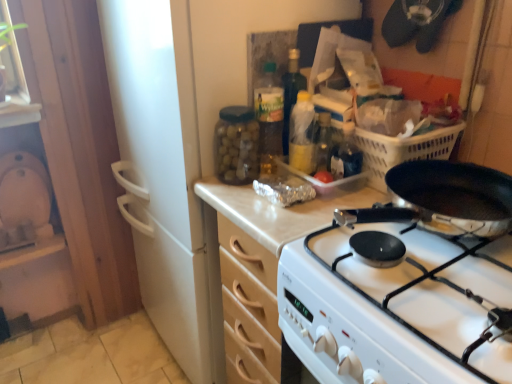
Describe the element at coordinates (433, 292) in the screenshot. I see `white glossy gas stove at center` at that location.

Where is `translucent plastic bottle at center, acting as the 1th bottle starting from the right`? The image size is (512, 384). translucent plastic bottle at center, acting as the 1th bottle starting from the right is located at coordinates (301, 134).

At what (x,y) coordinates should I click in order to perform the action: click on translucent plastic bottle at center, placed as the second bottle when sorted from left to right. Please return your answer as a coordinate pair (x, y). The image size is (512, 384). Looking at the image, I should click on (291, 92).

Is the surface of translucent plastic bottle at center, placed as the second bottle when sorted from left to right, in direct contact with translucent plastic bottle at center, acting as the third bottle starting from the left?

Yes, translucent plastic bottle at center, placed as the second bottle when sorted from left to right, is right next to translucent plastic bottle at center, acting as the third bottle starting from the left, and making contact.

Considering the sizes of objects translucent plastic bottle at center, placed as the second bottle when sorted from left to right, and translucent plastic bottle at center, acting as the third bottle starting from the left, in the image provided, who is shorter, translucent plastic bottle at center, placed as the second bottle when sorted from left to right, or translucent plastic bottle at center, acting as the third bottle starting from the left,?

With less height is translucent plastic bottle at center, acting as the third bottle starting from the left.

From a real-world perspective, is translucent plastic bottle at center, placed as the second bottle when sorted from left to right, under translucent plastic bottle at center, acting as the third bottle starting from the left?

No, from a real-world perspective, translucent plastic bottle at center, placed as the second bottle when sorted from left to right, is not beneath translucent plastic bottle at center, acting as the third bottle starting from the left.

Is translucent plastic bottle at center, the 2th bottle viewed from the right, oriented towards translucent plastic bottle at center, acting as the 1th bottle starting from the right?

No, translucent plastic bottle at center, the 2th bottle viewed from the right, is not turned towards translucent plastic bottle at center, acting as the 1th bottle starting from the right.

Is transparent glass jar at upper center, which is the third bottle from right to left, next to white glossy gas stove at center and touching it?

transparent glass jar at upper center, which is the third bottle from right to left, is not next to white glossy gas stove at center, and they're not touching.

Is white glossy gas stove at center surrounded by transparent glass jar at upper center, which is the first bottle from left to right?

That's incorrect, white glossy gas stove at center is not inside transparent glass jar at upper center, which is the first bottle from left to right.

Which is in front, transparent glass jar at upper center, which is the first bottle from left to right, or white glossy gas stove at center?

white glossy gas stove at center is more forward.

Is transparent glass jar at upper center, which is the first bottle from left to right, bigger than white glossy gas stove at center?

No.

Does white glossy gas stove at center have a smaller size compared to translucent plastic bottle at center, acting as the third bottle starting from the left?

Actually, white glossy gas stove at center might be larger than translucent plastic bottle at center, acting as the third bottle starting from the left.

Is white glossy gas stove at center not inside translucent plastic bottle at center, acting as the 1th bottle starting from the right?

Yes, white glossy gas stove at center is outside of translucent plastic bottle at center, acting as the 1th bottle starting from the right.

Does point (419, 297) come farther from viewer compared to point (294, 146)?

No, it is not.

In the scene shown: Which is more to the left, white glossy gas stove at center or translucent plastic bottle at center, acting as the 1th bottle starting from the right?

translucent plastic bottle at center, acting as the 1th bottle starting from the right.

Between translucent plastic bottle at center, acting as the 1th bottle starting from the right, and clear plastic container at center, which one is positioned in front?

translucent plastic bottle at center, acting as the 1th bottle starting from the right.

Are translucent plastic bottle at center, acting as the 1th bottle starting from the right, and clear plastic container at center located far from each other?

No, translucent plastic bottle at center, acting as the 1th bottle starting from the right, is not far away from clear plastic container at center.

Can you confirm if translucent plastic bottle at center, acting as the third bottle starting from the left, is shorter than clear plastic container at center?

No, translucent plastic bottle at center, acting as the third bottle starting from the left, is not shorter than clear plastic container at center.

Considering the positions of points (285, 76) and (328, 193), is point (285, 76) closer to camera compared to point (328, 193)?

No.

Visually, is translucent plastic bottle at center, placed as the second bottle when sorted from left to right, positioned to the left or to the right of clear plastic container at center?

translucent plastic bottle at center, placed as the second bottle when sorted from left to right, is positioned on clear plastic container at center's left side.

Is translucent plastic bottle at center, placed as the second bottle when sorted from left to right, beside clear plastic container at center?

translucent plastic bottle at center, placed as the second bottle when sorted from left to right, and clear plastic container at center are not in contact.

From the image's perspective, is translucent plastic bottle at center, the 2th bottle viewed from the right, above clear plastic container at center?

Indeed, from the image's perspective, translucent plastic bottle at center, the 2th bottle viewed from the right, is shown above clear plastic container at center.

From the image's perspective, is translucent plastic bottle at center, placed as the second bottle when sorted from left to right, beneath transparent glass jar at upper center, which is the third bottle from right to left?

Answer: No.

How many degrees apart are the facing directions of translucent plastic bottle at center, placed as the second bottle when sorted from left to right, and transparent glass jar at upper center, which is the third bottle from right to left?

The angular difference between translucent plastic bottle at center, placed as the second bottle when sorted from left to right, and transparent glass jar at upper center, which is the third bottle from right to left, is 89.7 degrees.

Is translucent plastic bottle at center, the 2th bottle viewed from the right, surrounding transparent glass jar at upper center, which is the third bottle from right to left?

Definitely not — transparent glass jar at upper center, which is the third bottle from right to left, is not inside translucent plastic bottle at center, the 2th bottle viewed from the right.

Can you confirm if translucent plastic bottle at center, the 2th bottle viewed from the right, is bigger than transparent glass jar at upper center, which is the third bottle from right to left?

No.

Considering the sizes of transparent glass jar at upper center, which is the first bottle from left to right, and translucent plastic bottle at center, acting as the 1th bottle starting from the right, in the image, is transparent glass jar at upper center, which is the first bottle from left to right, bigger or smaller than translucent plastic bottle at center, acting as the 1th bottle starting from the right,?

In the image, transparent glass jar at upper center, which is the first bottle from left to right, appears to be larger than translucent plastic bottle at center, acting as the 1th bottle starting from the right.

In the scene shown: From a real-world perspective, who is located higher, transparent glass jar at upper center, which is the first bottle from left to right, or translucent plastic bottle at center, acting as the third bottle starting from the left?

translucent plastic bottle at center, acting as the third bottle starting from the left.

Which of these two, transparent glass jar at upper center, which is the first bottle from left to right, or translucent plastic bottle at center, acting as the 1th bottle starting from the right, is wider?

transparent glass jar at upper center, which is the first bottle from left to right, is wider.

Can translucent plastic bottle at center, acting as the third bottle starting from the left, be found inside transparent glass jar at upper center, which is the first bottle from left to right?

No, translucent plastic bottle at center, acting as the third bottle starting from the left, is located outside of transparent glass jar at upper center, which is the first bottle from left to right.

This screenshot has width=512, height=384. I want to click on bottle above the translucent plastic bottle at center, acting as the third bottle starting from the left (from a real-world perspective), so click(291, 92).

From the image's perspective, count 1st bottles upward from the white glossy gas stove at center and point to it. Please provide its 2D coordinates.

[(236, 145)]

Which object lies further to the anchor point clear plastic container at center, transparent glass jar at upper center, which is the first bottle from left to right, or translucent plastic bottle at center, acting as the 1th bottle starting from the right?

transparent glass jar at upper center, which is the first bottle from left to right.

In the scene shown: Considering their positions, is white glossy gas stove at center positioned closer to wooden cabinet at center than translucent plastic bottle at center, acting as the 1th bottle starting from the right?

The object closer to wooden cabinet at center is translucent plastic bottle at center, acting as the 1th bottle starting from the right.

Looking at the image, which one is located further to transparent glass jar at upper center, which is the third bottle from right to left, clear plastic container at center or white glossy gas stove at center?

The object further to transparent glass jar at upper center, which is the third bottle from right to left, is white glossy gas stove at center.

Looking at the image, which one is located further to white glossy gas stove at center, wooden cabinet at center or clear plastic container at center?

Based on the image, clear plastic container at center appears to be further to white glossy gas stove at center.

Which object lies further to the anchor point white glossy gas stove at center, wooden cabinet at center or translucent plastic bottle at center, acting as the 1th bottle starting from the right?

Based on the image, translucent plastic bottle at center, acting as the 1th bottle starting from the right, appears to be further to white glossy gas stove at center.

Looking at the image, which one is located closer to translucent plastic bottle at center, acting as the third bottle starting from the left, translucent plastic bottle at center, the 2th bottle viewed from the right, or clear plastic container at center?

translucent plastic bottle at center, the 2th bottle viewed from the right, is positioned closer to the anchor translucent plastic bottle at center, acting as the third bottle starting from the left.

When comparing their distances from transparent glass jar at upper center, which is the first bottle from left to right, does clear plastic container at center or wooden cabinet at center seem further?

clear plastic container at center lies further to transparent glass jar at upper center, which is the first bottle from left to right, than the other object.

When comparing their distances from clear plastic container at center, does wooden cabinet at center or transparent glass jar at upper center, which is the third bottle from right to left, seem closer?

Among the two, wooden cabinet at center is located nearer to clear plastic container at center.

Locate an element on the screen. gas stove between translucent plastic bottle at center, acting as the third bottle starting from the left, and wooden cabinet at center vertically is located at coordinates (433, 292).

Find the location of a particular element. This screenshot has width=512, height=384. appliance between white glossy gas stove at center and translucent plastic bottle at center, the 2th bottle viewed from the right, along the z-axis is located at coordinates (328, 182).

Identify the location of appliance between transparent glass jar at upper center, which is the first bottle from left to right, and wooden cabinet at center in the up-down direction. 328,182.

Identify the location of appliance between translucent plastic bottle at center, acting as the 1th bottle starting from the right, and wooden cabinet at center from top to bottom. point(328,182).